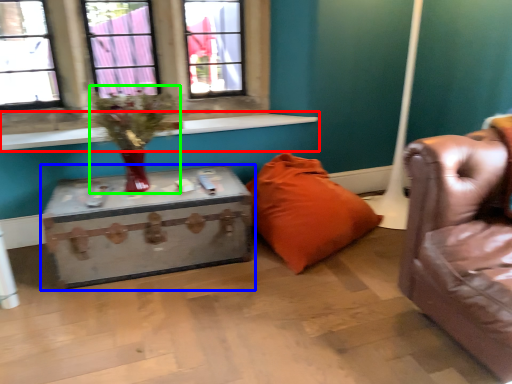
Question: Considering the real-world distances, which object is farthest from window sill (highlighted by a red box)? table (highlighted by a blue box) or floral arrangement (highlighted by a green box)?

Choices:
 (A) table
 (B) floral arrangement

Answer: (A)